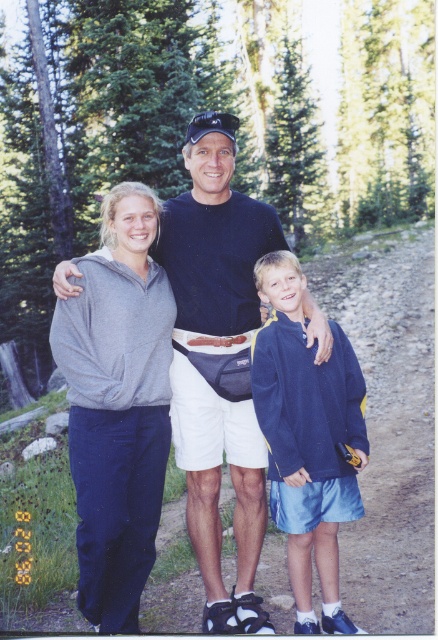
You are a photographer trying to capture a candid shot of the two people wearing the black cotton shirt at center and navy blue fleece at center. The camera has a minimum focus distance of 16 inches. Can you take a photo of both of them clearly without moving the camera?

The black cotton shirt at center and navy blue fleece at center are 16.17 inches apart from each other. Since the camera can focus as close as 16 inches, the distance between them is just over the minimum requirement. Therefore, the photographer can take a clear photo of both without moving the camera.

You are a photographer trying to capture a photo of the family. You notice two points in the scene marked as point 1 and point 2. Point 1 is at coordinates (117,442) and point 2 is at (307,605). Based on their positions, which point is closer to the camera?

Point 1 at coordinates (117,442) is closer to the camera than point 2 at (307,605) because it is further to the viewer according to the description.

You are a photographer standing in front of the family. You want to take a photo that includes both the gray fleece sweatshirt at left and the navy blue fleece at center. Which one will appear closer to you in the photo?

The gray fleece sweatshirt at left will appear closer to you in the photo because it is positioned closer to the viewer than the navy blue fleece at center.